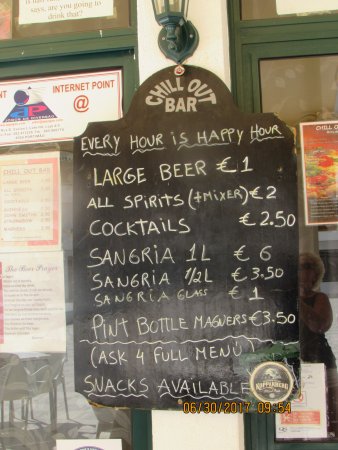
The height and width of the screenshot is (450, 338). I want to click on white vertical rectangular pillar, so click(212, 34).